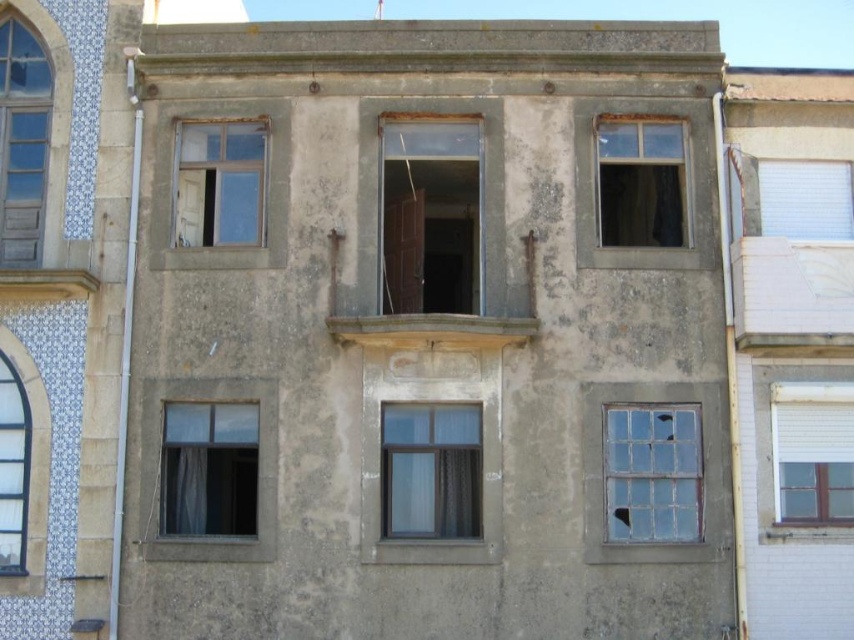
You are standing on the sidewalk in front of the building and want to look through both the clear glass window at lower right and the clear glass window at upper center. Which window will block your view of the other?

The clear glass window at lower right is in front of the clear glass window at upper center, so the clear glass window at lower right will block your view of the clear glass window at upper center.

You are standing in front of the building and notice two points marked on the facade. The first point is at coordinate point (x=430, y=308) and the second is at coordinate point (x=15, y=259). Which point is closer to your eyes?

Point (x=15, y=259) is closer to your eyes because it is closer to the camera than point (x=430, y=308).